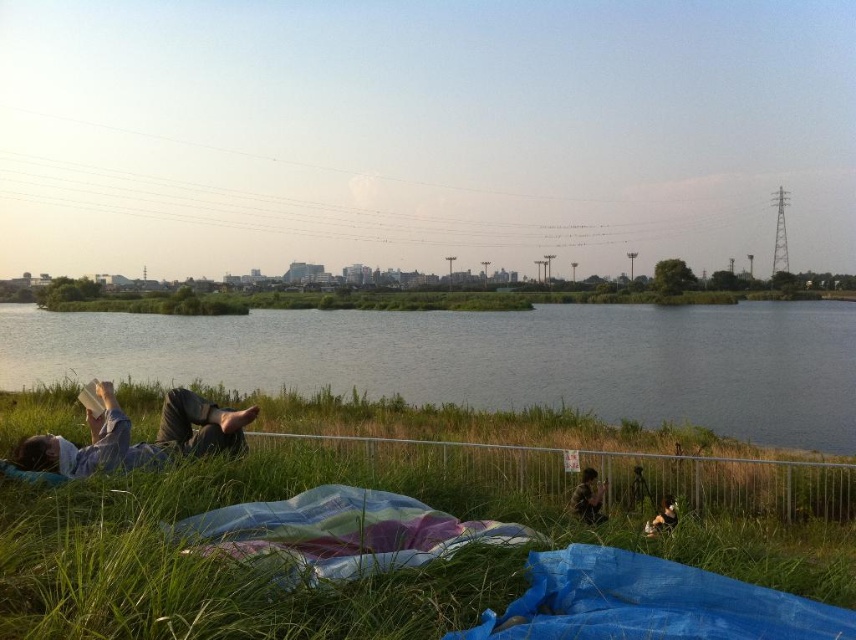
Question: Among these objects, which one is farthest from the camera?

Choices:
 (A) light blue fabric at lower left
 (B) blue water at center
 (C) green grassy at lower left

Answer: (B)

Question: Is green grassy at lower left below camouflage fabric jacket at lower right?

Choices:
 (A) no
 (B) yes

Answer: (A)

Question: Can you confirm if green grassy at lower left is wider than camouflage fabric jacket at lower right?

Choices:
 (A) yes
 (B) no

Answer: (A)

Question: Which object is closer to the camera taking this photo?

Choices:
 (A) blue water at center
 (B) light blue fabric at lower left
 (C) camouflage fabric jacket at lower right

Answer: (B)

Question: Which point is farther from the camera taking this photo?

Choices:
 (A) (358, 364)
 (B) (593, 508)
 (C) (669, 515)
 (D) (369, 499)

Answer: (A)

Question: Can you confirm if green grassy at lower left is bigger than fluffy brown dog at lower right?

Choices:
 (A) no
 (B) yes

Answer: (B)